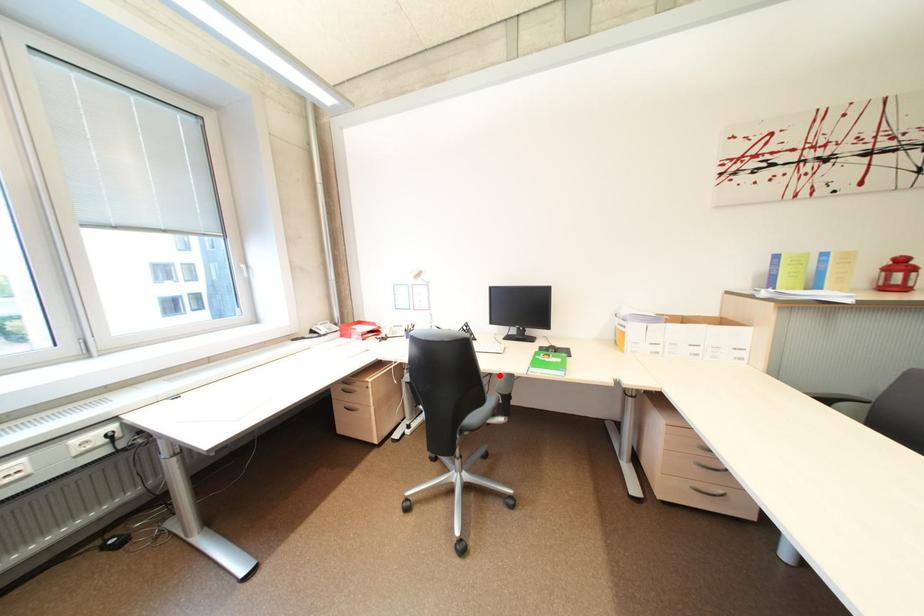
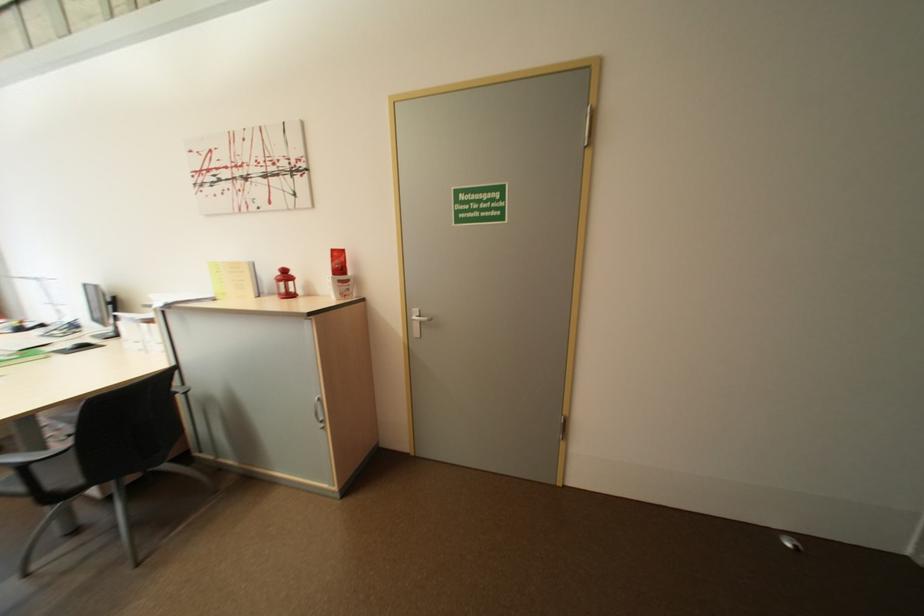
Question: I am providing you with two images of the same scene from different viewpoints. A red point is marked on the first image. At the location where the point appears in image 1, is it still visible in image 2?

Choices:
 (A) Yes
 (B) No

Answer: (B)